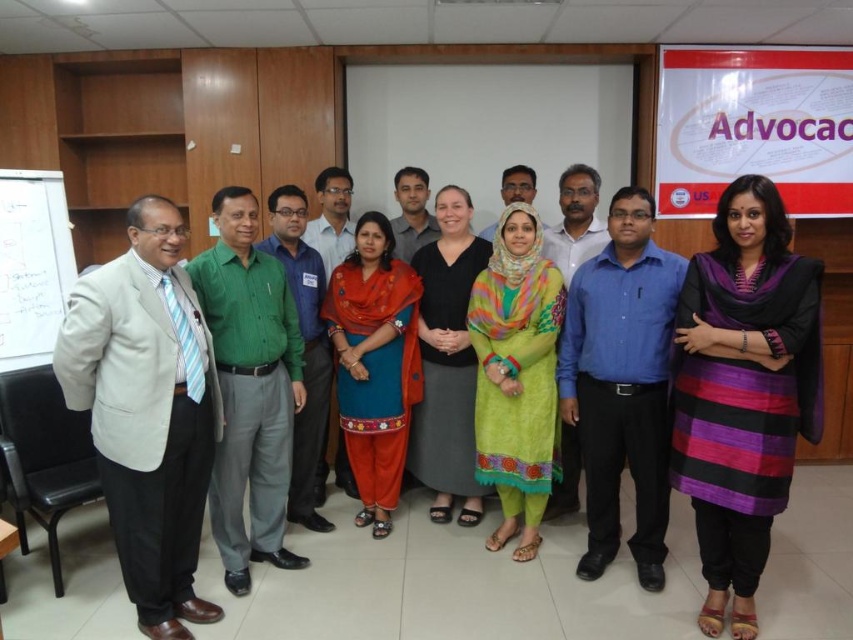
You are organizing a photo shoot and need to ensure proper lighting for all subjects. Given the blue cotton shirt at center and the black matte dress at center, which one might require additional lighting to avoid appearing too dark in the final image?

The black matte dress at center might require additional lighting to avoid appearing too dark in the final image because it is positioned under the blue cotton shirt at center, which could cast shadows or reduce its visibility.

You are standing in the conference room and want to find the black matte dress at center. According to the coordinates given, where would you look to find it?

The black matte dress at center is located at coordinates point (447,362).